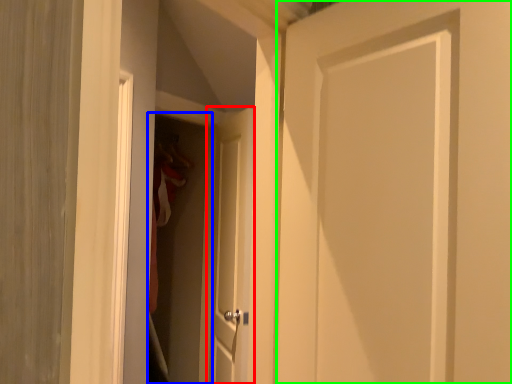
Question: Which object is positioned closest to door (highlighted by a red box)? Select from screen door (highlighted by a blue box) and door (highlighted by a green box).

Choices:
 (A) screen door
 (B) door

Answer: (A)